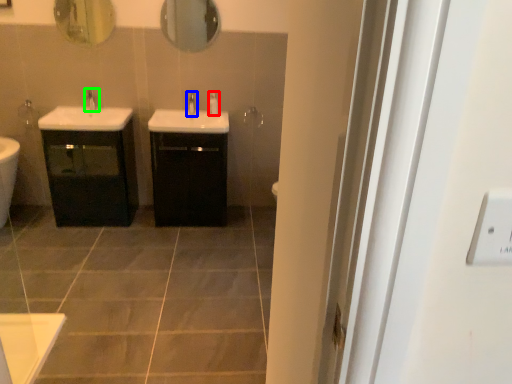
Question: Estimate the real-world distances between objects in this image. Which object is farther from soap dispenser (highlighted by a red box), tap (highlighted by a blue box) or tap (highlighted by a green box)?

Choices:
 (A) tap
 (B) tap

Answer: (B)